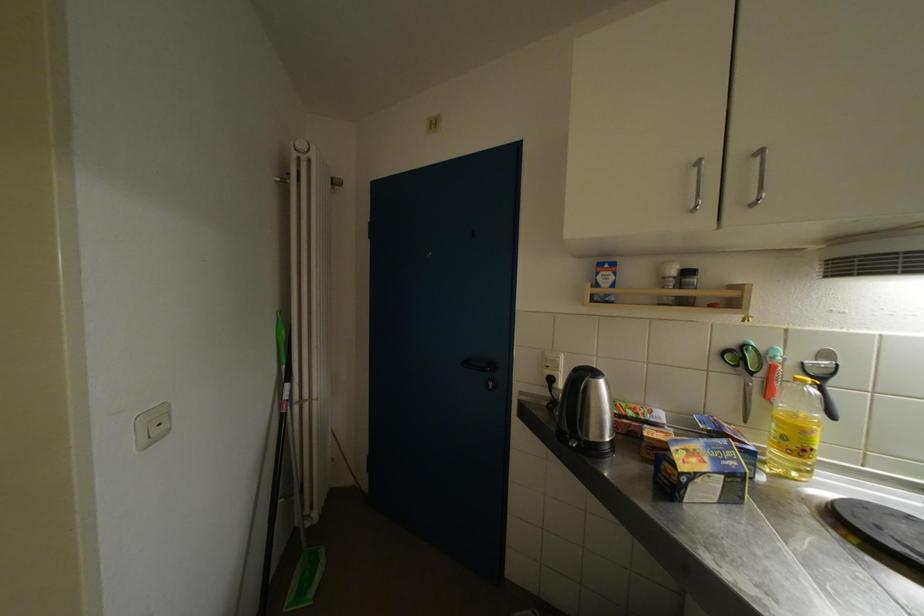
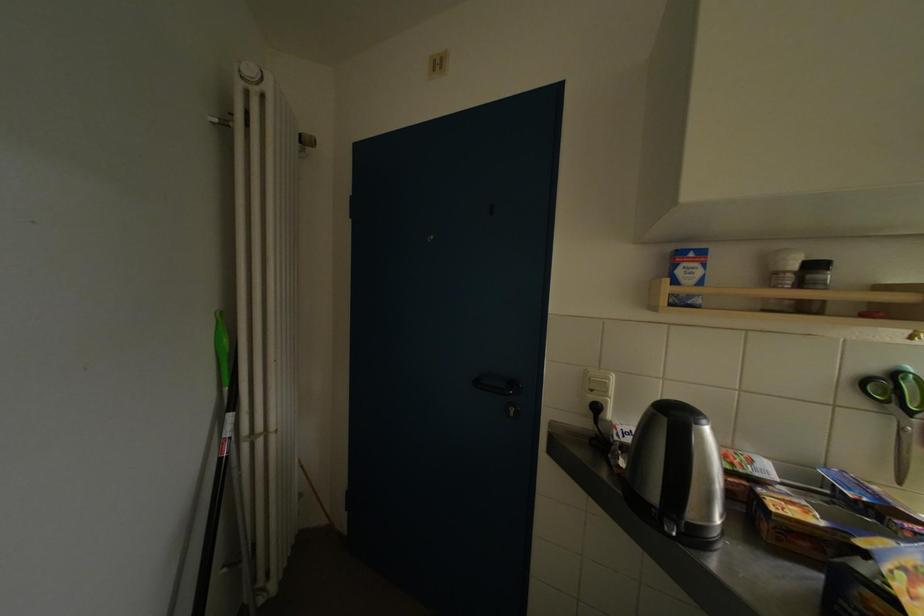
Question: How did the camera likely rotate?

Choices:
 (A) Left
 (B) Right
 (C) Up
 (D) Down

Answer: (B)